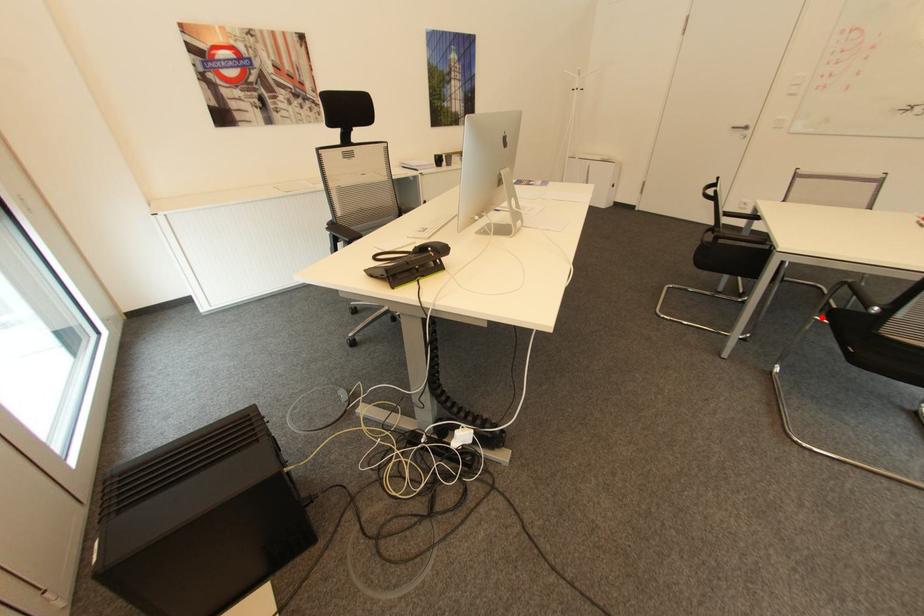
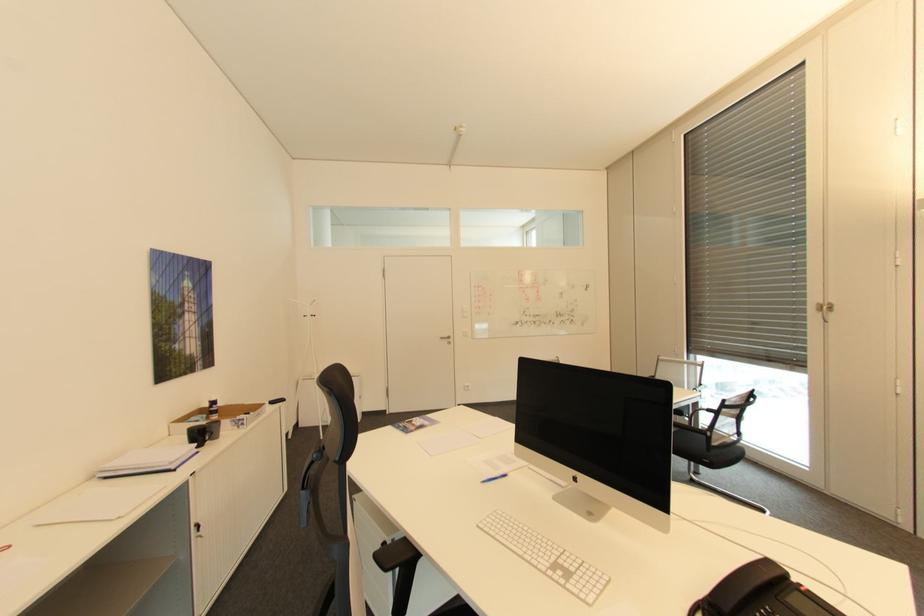
Question: I am providing you with two images of the same scene from different viewpoints. A red point is marked on the first image. Can you still see the location of the red point in image 2?

Choices:
 (A) Yes
 (B) No

Answer: (B)